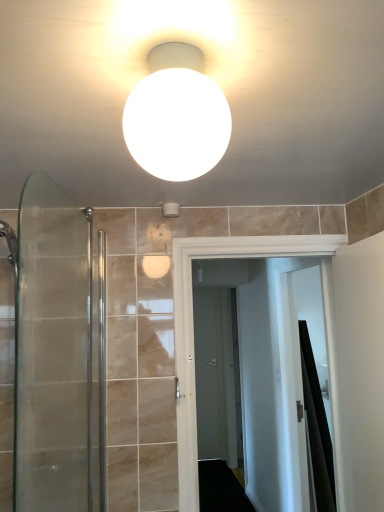
Question: Is white matte sphere at upper center smaller than white matte toilet paper holder at upper center?

Choices:
 (A) no
 (B) yes

Answer: (A)

Question: From the image's perspective, is white matte sphere at upper center above white matte toilet paper holder at upper center?

Choices:
 (A) yes
 (B) no

Answer: (A)

Question: Is white matte sphere at upper center beside white matte toilet paper holder at upper center?

Choices:
 (A) no
 (B) yes

Answer: (A)

Question: Does white matte sphere at upper center have a larger size compared to white matte toilet paper holder at upper center?

Choices:
 (A) no
 (B) yes

Answer: (B)

Question: Could white matte toilet paper holder at upper center be considered to be inside white matte sphere at upper center?

Choices:
 (A) no
 (B) yes

Answer: (A)

Question: Considering the positions of matte gray door at center and black fabric shower curtain at right in the image, is matte gray door at center taller or shorter than black fabric shower curtain at right?

Choices:
 (A) short
 (B) tall

Answer: (B)

Question: Looking at their shapes, would you say matte gray door at center is wider or thinner than black fabric shower curtain at right?

Choices:
 (A) thin
 (B) wide

Answer: (A)

Question: From a real-world perspective, is matte gray door at center physically located above or below black fabric shower curtain at right?

Choices:
 (A) above
 (B) below

Answer: (A)

Question: Is matte gray door at center to the left or to the right of black fabric shower curtain at right in the image?

Choices:
 (A) left
 (B) right

Answer: (A)

Question: Looking at the image, does white matte sphere at upper center seem bigger or smaller compared to white matte toilet paper holder at upper center?

Choices:
 (A) small
 (B) big

Answer: (B)

Question: In terms of width, does white matte sphere at upper center look wider or thinner when compared to white matte toilet paper holder at upper center?

Choices:
 (A) thin
 (B) wide

Answer: (B)

Question: From a real-world perspective, is white matte sphere at upper center above or below white matte toilet paper holder at upper center?

Choices:
 (A) above
 (B) below

Answer: (B)

Question: From the image's perspective, is white matte sphere at upper center positioned above or below white matte toilet paper holder at upper center?

Choices:
 (A) below
 (B) above

Answer: (B)

Question: Is clear glass shower door at left wider or thinner than white matte sphere at upper center?

Choices:
 (A) thin
 (B) wide

Answer: (A)

Question: In the image, is clear glass shower door at left on the left side or the right side of white matte sphere at upper center?

Choices:
 (A) right
 (B) left

Answer: (B)